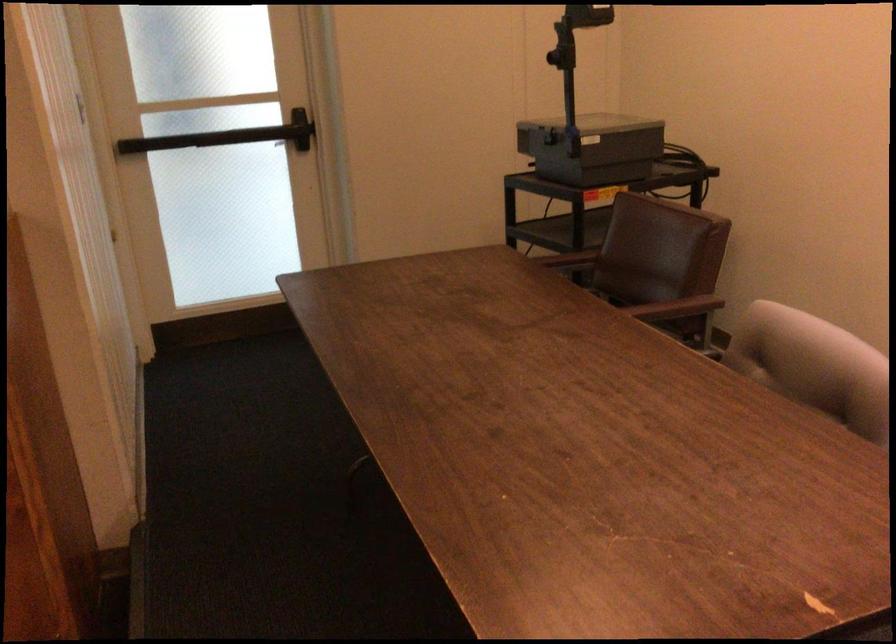
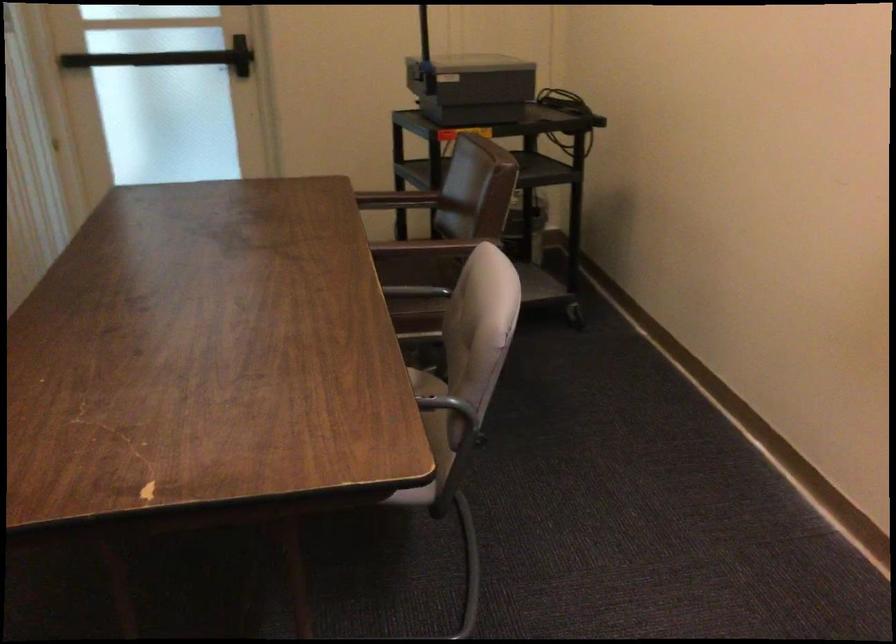
Question: Based on the continuous images, in which direction is the camera rotating? Reply with the corresponding letter.

Choices:
 (A) Left
 (B) Right
 (C) Up
 (D) Down

Answer: (A)